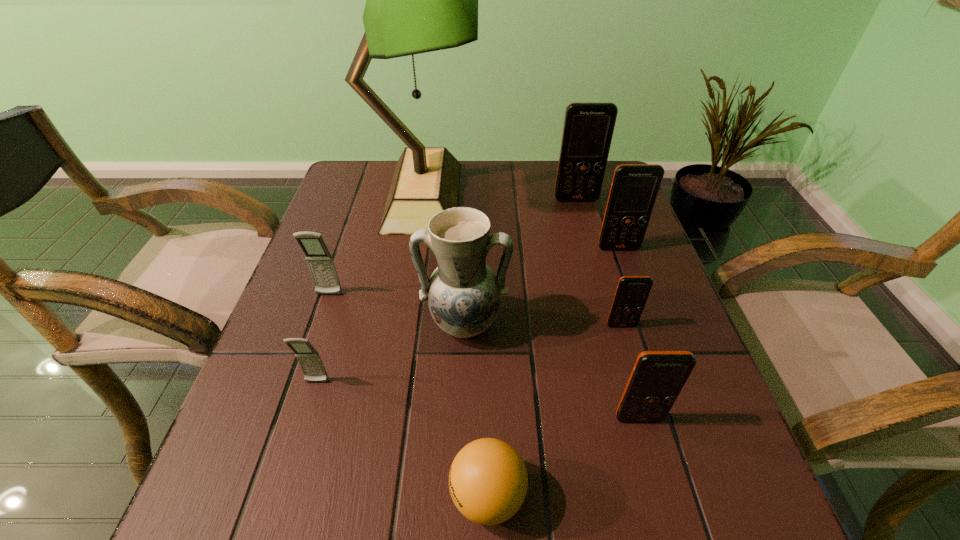
This screenshot has width=960, height=540. In order to click on object positioned at the near edge in this screenshot , I will do `click(488, 481)`.

The width and height of the screenshot is (960, 540). I want to click on table lamp at the left edge, so click(x=418, y=0).

You are a GUI agent. You are given a task and a screenshot of the screen. Output one action in this format:
    pyautogui.click(x=<x>, y=<y>)
    Task: Click on the object at the far left corner
    This screenshot has height=540, width=960.
    Given the screenshot: What is the action you would take?
    pyautogui.click(x=418, y=0)

The height and width of the screenshot is (540, 960). I want to click on object located in the far right corner section of the desktop, so click(x=588, y=128).

Identify the location of vacant space at the far edge of the desktop. (483, 164).

Identify the location of vacant point at the near edge. Image resolution: width=960 pixels, height=540 pixels. (374, 502).

Locate an element on the screen. blank space at the left edge of the desktop is located at coordinates (324, 449).

Where is `free region at the right edge of the desktop`? This screenshot has height=540, width=960. free region at the right edge of the desktop is located at coordinates (615, 357).

The width and height of the screenshot is (960, 540). I want to click on vacant space at the far left corner of the desktop, so click(350, 165).

At what (x,y) coordinates should I click in order to perform the action: click on free spot between the third biggest orange cellular telephone and the fourth farthest cellular telephone. Please return your answer as a coordinate pair (x, y). The height and width of the screenshot is (540, 960). Looking at the image, I should click on (630, 372).